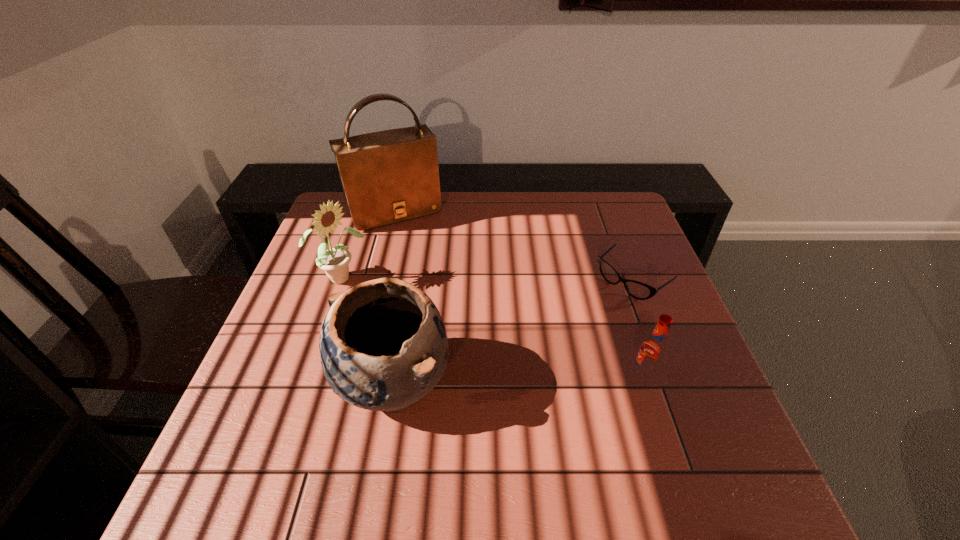
Find the location of a particular element. This screenshot has height=540, width=960. unoccupied area between the spectacles and the root beer is located at coordinates (637, 329).

You are a GUI agent. You are given a task and a screenshot of the screen. Output one action in this format:
    pyautogui.click(x=<x>, y=<y>)
    Task: Click on the free spot between the shoulder bag and the second shortest object
    
    Given the screenshot: What is the action you would take?
    (518, 294)

Find the location of a particular element. free spot between the pottery and the second shortest object is located at coordinates (518, 380).

What are the coordinates of `free space between the shoulder bag and the second shortest object` in the screenshot? It's located at (518, 294).

Find the location of `free area in between the sunflower and the root beer`. free area in between the sunflower and the root beer is located at coordinates (492, 328).

You are a GUI agent. You are given a task and a screenshot of the screen. Output one action in this format:
    pyautogui.click(x=<x>, y=<y>)
    Task: Click on the free space between the shortest object and the fourth tallest object
    
    Given the screenshot: What is the action you would take?
    pyautogui.click(x=637, y=329)

This screenshot has height=540, width=960. In order to click on empty space that is in between the sunflower and the shoulder bag in this screenshot , I will do `click(368, 245)`.

Locate an element on the screen. Image resolution: width=960 pixels, height=540 pixels. free space that is in between the farthest object and the sunflower is located at coordinates (368, 245).

Locate which object is the fourth closest to the fourth tallest object. Please provide its 2D coordinates. Your answer should be formatted as a tuple, i.e. [(x, y)], where the tuple contains the x and y coordinates of a point satisfying the conditions above.

[(390, 176)]

Select which object appears as the third closest to the sunflower. Please provide its 2D coordinates. Your answer should be formatted as a tuple, i.e. [(x, y)], where the tuple contains the x and y coordinates of a point satisfying the conditions above.

[(638, 290)]